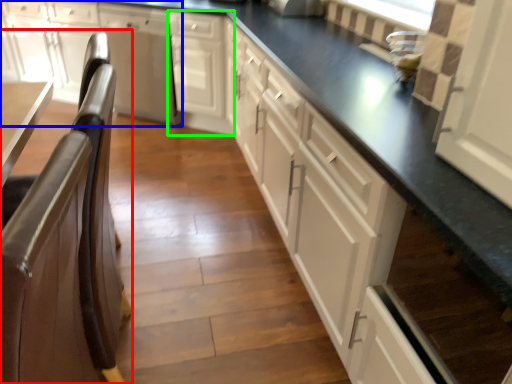
Question: Based on their relative distances, which object is farther from chair (highlighted by a red box)? Choose from cabinetry (highlighted by a blue box) and cabinetry (highlighted by a green box).

Choices:
 (A) cabinetry
 (B) cabinetry

Answer: (A)